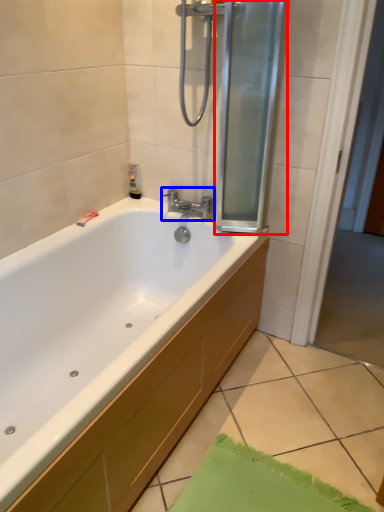
Question: Among these objects, which one is farthest to the camera, screen door (highlighted by a red box) or tap (highlighted by a blue box)?

Choices:
 (A) screen door
 (B) tap

Answer: (B)